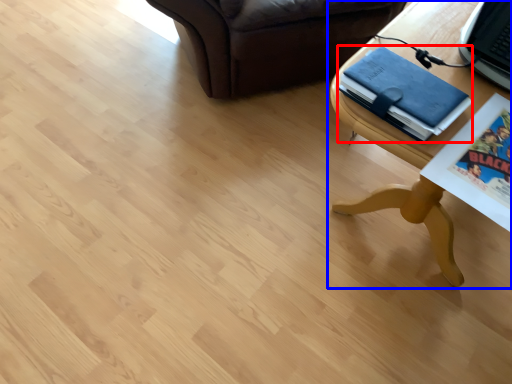
Question: Among these objects, which one is nearest to the camera, binder (highlighted by a red box) or table (highlighted by a blue box)?

Choices:
 (A) binder
 (B) table

Answer: (B)